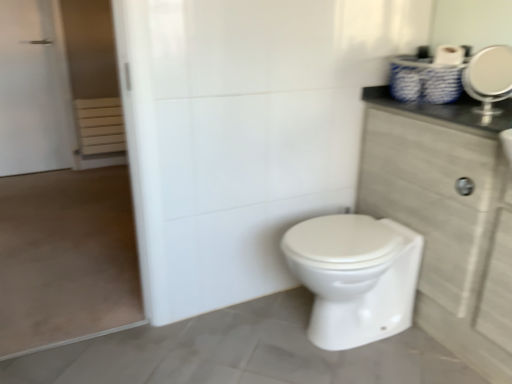
Question: Is white matte screen door at left taller or shorter than white glossy toilet at center?

Choices:
 (A) tall
 (B) short

Answer: (A)

Question: From the image's perspective, is white matte screen door at left positioned above or below white glossy toilet at center?

Choices:
 (A) above
 (B) below

Answer: (A)

Question: Which of these objects is positioned closest to the white glossy toilet at center?

Choices:
 (A) silver metallic mirror at upper right
 (B) wooden cabinet at right
 (C) white matte screen door at left

Answer: (B)

Question: Which of these objects is positioned farthest from the white glossy toilet at center?

Choices:
 (A) wooden cabinet at right
 (B) silver metallic mirror at upper right
 (C) white matte screen door at left

Answer: (C)